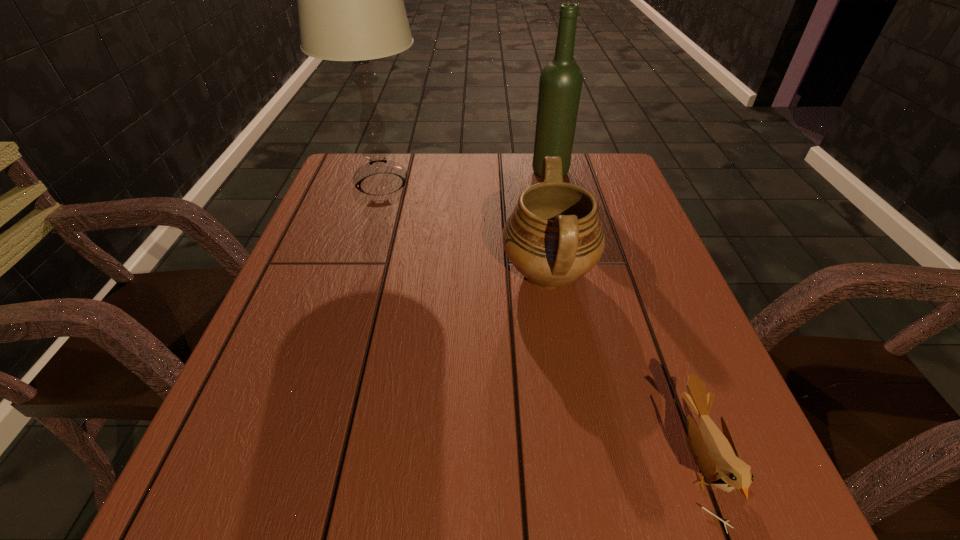
Identify the location of vacant position located on the front-facing side of the urn. Image resolution: width=960 pixels, height=540 pixels. (349, 274).

At what (x,y) coordinates should I click in order to perform the action: click on blank space located on the front-facing side of the urn. Please return your answer as a coordinate pair (x, y). Image resolution: width=960 pixels, height=540 pixels. Looking at the image, I should click on (364, 274).

At what (x,y) coordinates should I click in order to perform the action: click on vacant space situated at the beak of the shortest object. Please return your answer as a coordinate pair (x, y). This screenshot has width=960, height=540. Looking at the image, I should click on (445, 460).

In order to click on vacant area located at the beak of the shortest object in this screenshot , I will do `click(480, 460)`.

This screenshot has width=960, height=540. Identify the location of free space located 0.060m at the beak of the shortest object. (638, 460).

Find the location of a particular element. The height and width of the screenshot is (540, 960). table lamp located in the far edge section of the desktop is located at coordinates (350, 3).

Locate an element on the screen. This screenshot has width=960, height=540. wine bottle that is at the far edge is located at coordinates (560, 84).

This screenshot has width=960, height=540. In order to click on object situated at the near edge in this screenshot , I will do `click(715, 454)`.

Identify the location of object situated at the left edge. This screenshot has width=960, height=540. (350, 3).

The height and width of the screenshot is (540, 960). In order to click on wine bottle at the right edge in this screenshot , I will do `click(560, 84)`.